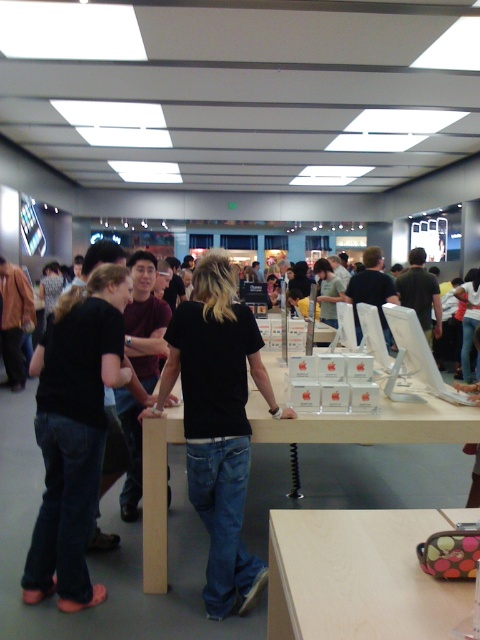
You are a customer in the Apple Store and want to place your coffee cup on a table. Which table, the wooden table at lower right or the light wood table at center, is better suited for placing a taller coffee cup?

The wooden table at lower right is taller than the light wood table at center, so it is better suited for placing a taller coffee cup.

You are a customer in an Apple Store and want to place your black matte shirt at center on the light wood table at center. Is there enough space between them for you to place it?

The black matte shirt at center is 18.50 inches away from the light wood table at center, so there is sufficient space to place the shirt on the table.